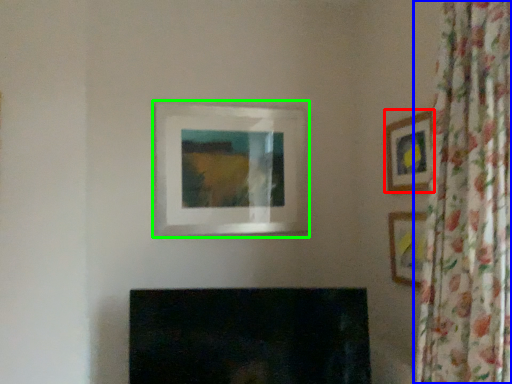
Question: Considering the real-world distances, which object is closest to picture frame (highlighted by a red box)? curtain (highlighted by a blue box) or picture frame (highlighted by a green box).

Choices:
 (A) curtain
 (B) picture frame

Answer: (A)